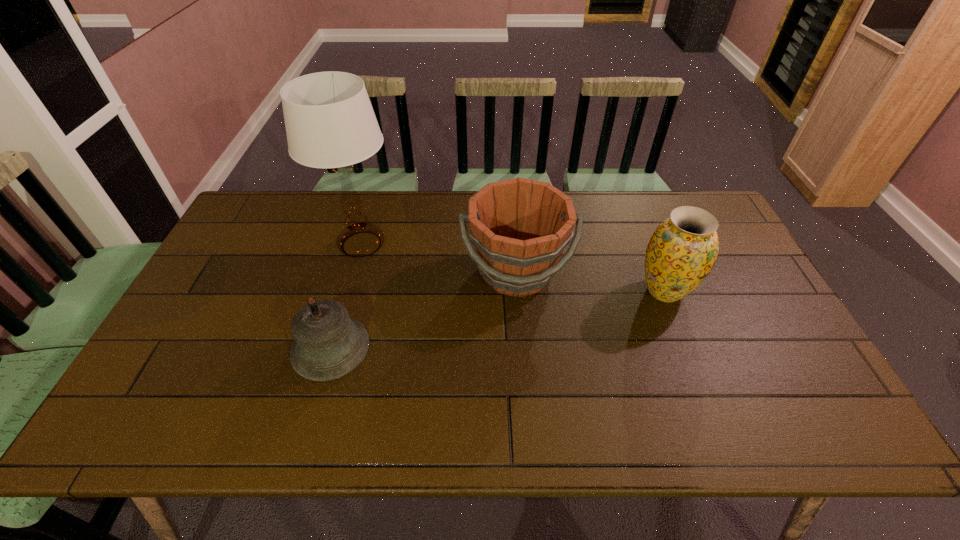
Locate an element on the screen. The image size is (960, 540). table lamp is located at coordinates (330, 123).

Locate an element on the screen. the rightmost object is located at coordinates tap(683, 249).

Locate an element on the screen. bucket is located at coordinates (520, 227).

Locate an element on the screen. bell is located at coordinates pyautogui.click(x=328, y=344).

Locate an element on the screen. The width and height of the screenshot is (960, 540). the nearest object is located at coordinates (328, 344).

This screenshot has height=540, width=960. What are the coordinates of `free location located 0.080m on the front-facing side of the table lamp` in the screenshot? It's located at (425, 245).

The width and height of the screenshot is (960, 540). In order to click on free space located on the back of the vase in this screenshot , I will do `click(638, 226)`.

This screenshot has height=540, width=960. Identify the location of vacant area situated 0.190m on the handle side of the bucket. 524,369.

Find the location of a particular element. free space located 0.360m on the back of the shortest object is located at coordinates (364, 231).

This screenshot has width=960, height=540. I want to click on object positioned at the far edge, so click(330, 123).